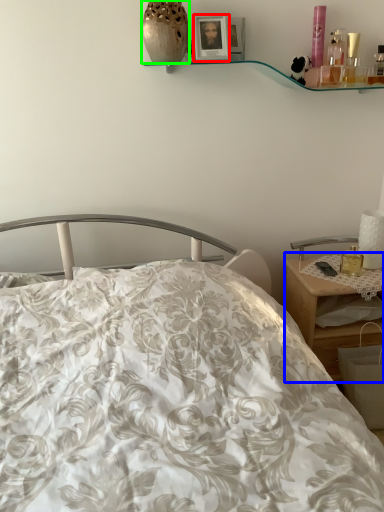
Question: Which is farther away from picture frame (highlighted by a red box)? desk (highlighted by a blue box) or vase (highlighted by a green box)?

Choices:
 (A) desk
 (B) vase

Answer: (A)